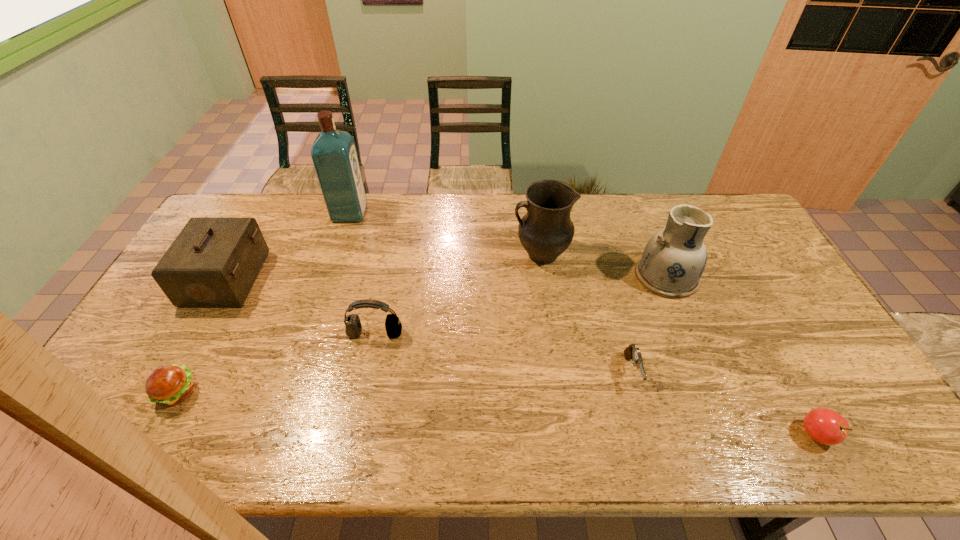
You are a GUI agent. You are given a task and a screenshot of the screen. Output one action in this format:
    pyautogui.click(x=<x>, y=<y>)
    Task: Click on the free space located on the left of the apple
    
    Given the screenshot: What is the action you would take?
    pyautogui.click(x=723, y=434)

The image size is (960, 540). Find the location of `object present at the far edge`. object present at the far edge is located at coordinates (334, 155).

Locate an element on the screen. object that is at the near edge is located at coordinates (825, 426).

The height and width of the screenshot is (540, 960). In order to click on the first-aid kit located in the left edge section of the desktop in this screenshot , I will do `click(213, 262)`.

At what (x,y) coordinates should I click in order to perform the action: click on hamburger at the left edge. Please return your answer as a coordinate pair (x, y). The width and height of the screenshot is (960, 540). Looking at the image, I should click on (170, 385).

Where is `object that is at the right edge`? object that is at the right edge is located at coordinates click(x=825, y=426).

Where is `object situated at the near right corner`? object situated at the near right corner is located at coordinates (825, 426).

Where is `vacant position at the far edge of the desktop`? Image resolution: width=960 pixels, height=540 pixels. vacant position at the far edge of the desktop is located at coordinates (402, 197).

The height and width of the screenshot is (540, 960). In the image, there is a desktop. What are the coordinates of `vacant space at the near edge` in the screenshot? It's located at (461, 435).

Identify the location of vacant space at the near left corner. (91, 437).